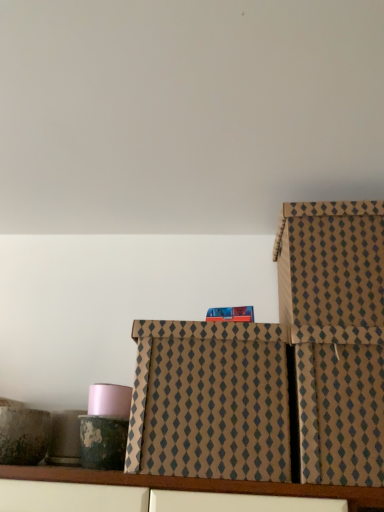
This screenshot has width=384, height=512. I want to click on brown textured box at right, the 2th box positioned from the left, so click(336, 335).

What do you see at coordinates (336, 335) in the screenshot? The image size is (384, 512). I see `brown textured box at right, the 2th box positioned from the left` at bounding box center [336, 335].

What is the approximate height of brown textured box at right, the first box positioned from the right?

It is 32.51 centimeters.

At what (x,y) coordinates should I click in order to perform the action: click on brown textured box at center, which ranks as the second box in right-to-left order. Please return your answer as a coordinate pair (x, y). The height and width of the screenshot is (512, 384). Looking at the image, I should click on (209, 401).

This screenshot has height=512, width=384. Describe the element at coordinates (209, 401) in the screenshot. I see `brown textured box at center, the first box positioned from the left` at that location.

At what (x,y) coordinates should I click in order to perform the action: click on brown textured box at right, the 2th box positioned from the left. Please return your answer as a coordinate pair (x, y). This screenshot has width=384, height=512. Looking at the image, I should click on (336, 335).

Does brown textured box at right, the first box positioned from the right, appear on the right side of brown textured box at center, which ranks as the second box in right-to-left order?

Yes.

Considering their positions, is brown textured box at right, the 2th box positioned from the left, located in front of or behind brown textured box at center, which ranks as the second box in right-to-left order?

In the image, brown textured box at right, the 2th box positioned from the left, appears in front of brown textured box at center, which ranks as the second box in right-to-left order.

From the picture: Which is closer to the camera, (309, 420) or (223, 335)?

Point (309, 420).

Consider the image. From the image's perspective, relative to brown textured box at center, which ranks as the second box in right-to-left order, is brown textured box at right, the 2th box positioned from the left, above or below?

brown textured box at right, the 2th box positioned from the left, is situated lower than brown textured box at center, which ranks as the second box in right-to-left order, in the image.

From a real-world perspective, is brown textured box at right, the 2th box positioned from the left, on brown textured box at center, which ranks as the second box in right-to-left order?

Actually, brown textured box at right, the 2th box positioned from the left, is physically below brown textured box at center, which ranks as the second box in right-to-left order, in the real world.

Between brown textured box at right, the first box positioned from the right, and brown textured box at center, the first box positioned from the left, which one has smaller width?

brown textured box at right, the first box positioned from the right, is thinner.

Who is shorter, brown textured box at right, the 2th box positioned from the left, or brown textured box at center, which ranks as the second box in right-to-left order?

Standing shorter between the two is brown textured box at right, the 2th box positioned from the left.

Looking at the image, does brown textured box at right, the first box positioned from the right, seem bigger or smaller compared to brown textured box at center, the first box positioned from the left?

Considering their sizes, brown textured box at right, the first box positioned from the right, takes up less space than brown textured box at center, the first box positioned from the left.

Would you say brown textured box at center, which ranks as the second box in right-to-left order, is part of brown textured box at right, the first box positioned from the right,'s contents?

No, brown textured box at center, which ranks as the second box in right-to-left order, is not inside brown textured box at right, the first box positioned from the right.

Is brown textured box at right, the 2th box positioned from the left, next to brown textured box at center, the first box positioned from the left?

No, brown textured box at right, the 2th box positioned from the left, is not beside brown textured box at center, the first box positioned from the left.

In the scene shown: Is brown textured box at right, the 2th box positioned from the left, oriented towards brown textured box at center, which ranks as the second box in right-to-left order?

No, brown textured box at right, the 2th box positioned from the left, is not facing towards brown textured box at center, which ranks as the second box in right-to-left order.

What's the angular difference between brown textured box at right, the 2th box positioned from the left, and brown textured box at center, the first box positioned from the left,'s facing directions?

0.000399 degrees.

The image size is (384, 512). Identify the location of box below the brown textured box at center, which ranks as the second box in right-to-left order (from a real-world perspective). (336, 335).

Consider the image. Is brown textured box at center, which ranks as the second box in right-to-left order, to the left of brown textured box at right, the first box positioned from the right, from the viewer's perspective?

Indeed, brown textured box at center, which ranks as the second box in right-to-left order, is positioned on the left side of brown textured box at right, the first box positioned from the right.

Consider the image. Which is in front, brown textured box at center, which ranks as the second box in right-to-left order, or brown textured box at right, the first box positioned from the right?

brown textured box at right, the first box positioned from the right, is closer to the camera.

Considering the points (196, 474) and (302, 339), which point is in front, point (196, 474) or point (302, 339)?

The point (196, 474) is more forward.

From the image's perspective, which is below, brown textured box at center, which ranks as the second box in right-to-left order, or brown textured box at right, the first box positioned from the right?

brown textured box at right, the first box positioned from the right, appears lower in the image.

From a real-world perspective, does brown textured box at center, which ranks as the second box in right-to-left order, stand above brown textured box at right, the 2th box positioned from the left?

Correct, in the physical world, brown textured box at center, which ranks as the second box in right-to-left order, is higher than brown textured box at right, the 2th box positioned from the left.

Considering the sizes of objects brown textured box at center, which ranks as the second box in right-to-left order, and brown textured box at right, the first box positioned from the right, in the image provided, who is wider, brown textured box at center, which ranks as the second box in right-to-left order, or brown textured box at right, the first box positioned from the right,?

Wider between the two is brown textured box at center, which ranks as the second box in right-to-left order.

Considering the relative sizes of brown textured box at center, which ranks as the second box in right-to-left order, and brown textured box at right, the 2th box positioned from the left, in the image provided, is brown textured box at center, which ranks as the second box in right-to-left order, shorter than brown textured box at right, the 2th box positioned from the left,?

No, brown textured box at center, which ranks as the second box in right-to-left order, is not shorter than brown textured box at right, the 2th box positioned from the left.

Between brown textured box at center, which ranks as the second box in right-to-left order, and brown textured box at right, the first box positioned from the right, which one has smaller size?

brown textured box at right, the first box positioned from the right.

Would you say brown textured box at center, the first box positioned from the left, contains brown textured box at right, the 2th box positioned from the left?

No, brown textured box at right, the 2th box positioned from the left, is not a part of brown textured box at center, the first box positioned from the left.

Is brown textured box at center, which ranks as the second box in right-to-left order, not near brown textured box at right, the first box positioned from the right?

No.

Is brown textured box at center, which ranks as the second box in right-to-left order, looking in the opposite direction of brown textured box at right, the 2th box positioned from the left?

No.

What's the angular difference between brown textured box at center, the first box positioned from the left, and brown textured box at right, the 2th box positioned from the left,'s facing directions?

0.000399 degrees.

How much distance is there between brown textured box at center, the first box positioned from the left, and brown textured box at right, the 2th box positioned from the left?

7.42 inches.

Locate an element on the screen. The width and height of the screenshot is (384, 512). box that is behind the brown textured box at right, the 2th box positioned from the left is located at coordinates (209, 401).

Identify the location of box on the right of brown textured box at center, the first box positioned from the left. tap(336, 335).

Where is `box on the left side of brown textured box at right, the first box positioned from the right`? This screenshot has height=512, width=384. box on the left side of brown textured box at right, the first box positioned from the right is located at coordinates (209, 401).